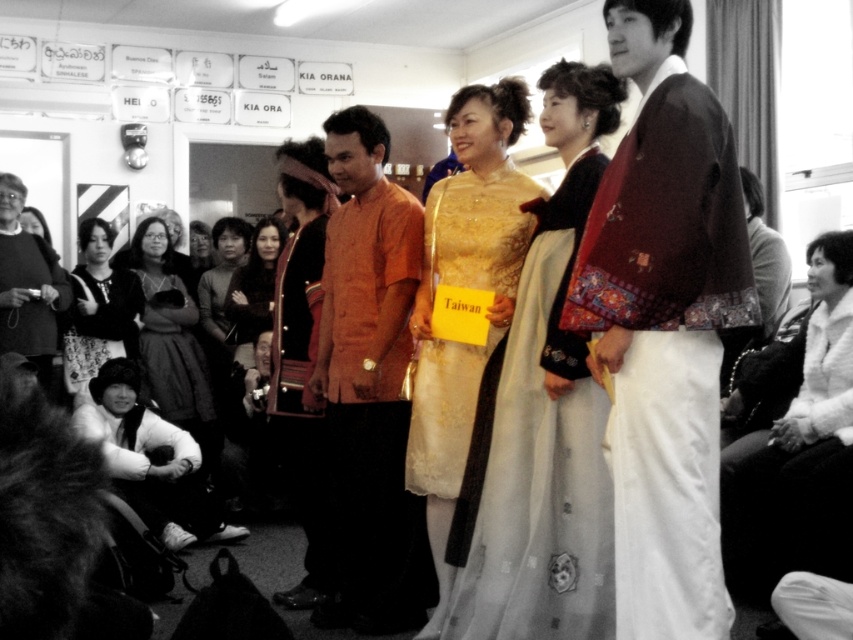
Question: Estimate the real-world distances between objects in this image. Which object is closer to the matte black sweater at left?

Choices:
 (A) orange matte shirt at center
 (B) matte brown kimono at center
 (C) gold lace dress at center

Answer: (A)

Question: Does matte brown kimono at center come in front of black silk dress at center?

Choices:
 (A) yes
 (B) no

Answer: (A)

Question: Is smooth white blouse at lower right positioned in front of dark gray dress at lower left?

Choices:
 (A) no
 (B) yes

Answer: (B)

Question: Can you confirm if dark gray dress at lower left is smaller than black silk dress at center?

Choices:
 (A) no
 (B) yes

Answer: (A)

Question: Which object appears farthest from the camera in this image?

Choices:
 (A) black silk dress at center
 (B) matte orange blouse at center
 (C) gold lace dress at center
 (D) smooth white blouse at lower right

Answer: (A)

Question: Which point is farther to the camera?

Choices:
 (A) (13, 248)
 (B) (78, 284)
 (C) (206, 452)
 (D) (459, 243)

Answer: (B)